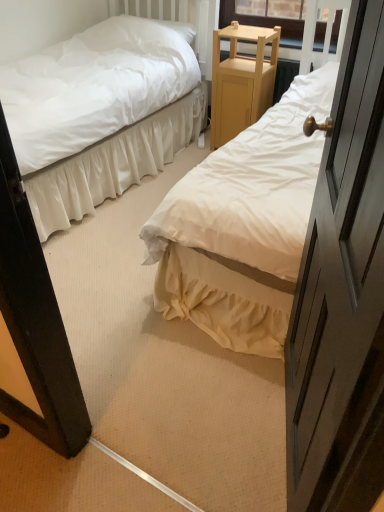
Question: Does point (276, 116) appear closer or farther from the camera than point (104, 151)?

Choices:
 (A) farther
 (B) closer

Answer: (B)

Question: From the image's perspective, is white cotton bed at center, the 2th bed positioned from the left, located above or below white satin bed at center, which is the 1th bed in left-to-right order?

Choices:
 (A) above
 (B) below

Answer: (B)

Question: Which is farther from the white soft pillow at upper left?

Choices:
 (A) white satin bed at center, which is the 1th bed in left-to-right order
 (B) white cotton bed at center, the 2th bed positioned from the left
 (C) light wood/finely crafted nightstand at center

Answer: (B)

Question: Considering the real-world distances, which object is farthest from the white cotton bed at center, the 2th bed positioned from the left?

Choices:
 (A) light wood/finely crafted nightstand at center
 (B) white satin bed at center, which is the 1th bed in left-to-right order
 (C) white soft pillow at upper left

Answer: (C)